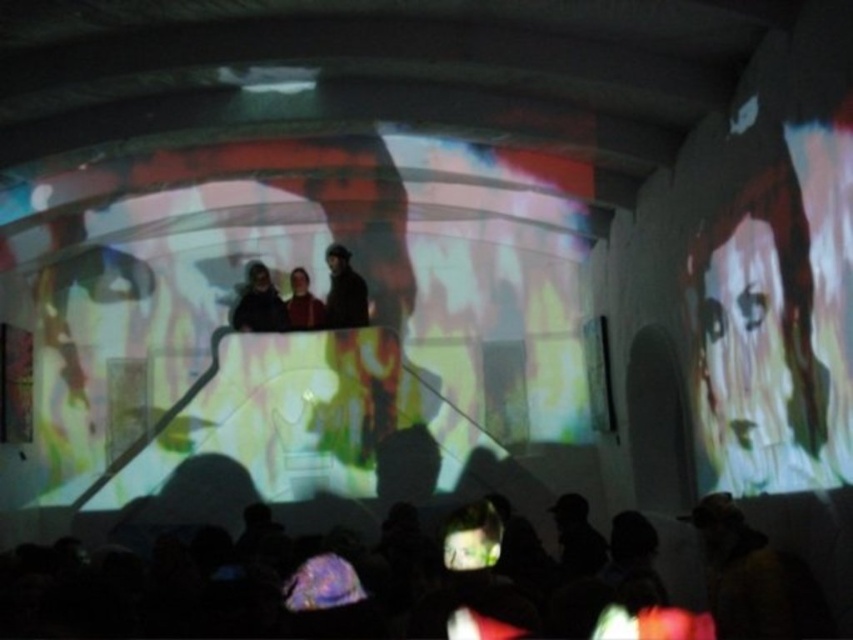
Question: Does dark brown leather jacket at center have a lesser width compared to matte red shirt at center?

Choices:
 (A) yes
 (B) no

Answer: (B)

Question: Which object appears closest to the camera in this image?

Choices:
 (A) matte black jacket at center
 (B) dark brown leather jacket at center
 (C) translucent fabric screen at center

Answer: (A)

Question: Considering the relative positions of translucent fabric screen at center and matte black jacket at center in the image provided, where is translucent fabric screen at center located with respect to matte black jacket at center?

Choices:
 (A) above
 (B) below

Answer: (A)

Question: Which of the following is the closest to the observer?

Choices:
 (A) (288, 442)
 (B) (283, 312)
 (C) (303, 288)

Answer: (A)

Question: Which point appears farthest from the camera in this image?

Choices:
 (A) (402, 236)
 (B) (363, 301)
 (C) (292, 273)
 (D) (264, 525)

Answer: (A)

Question: Is translucent fabric screen at center further to camera compared to dark brown leather jacket at center?

Choices:
 (A) no
 (B) yes

Answer: (B)